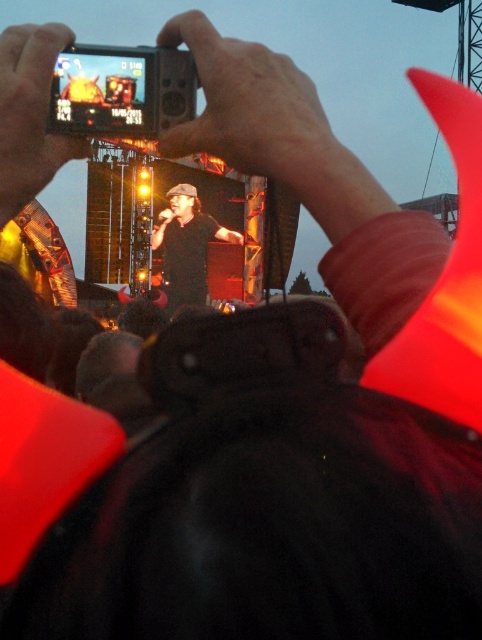
Question: Where is black plastic camera at upper center located in relation to matte black phone at upper left in the image?

Choices:
 (A) above
 (B) below

Answer: (A)

Question: Can you confirm if matte black phone at upper left is positioned to the right of black matte shirt at center?

Choices:
 (A) yes
 (B) no

Answer: (B)

Question: Which of the following is the farthest from the observer?

Choices:
 (A) matte black phone at upper left
 (B) black plastic camera at upper center
 (C) black matte shirt at center

Answer: (C)

Question: Which of the following is the closest to the observer?

Choices:
 (A) black matte shirt at center
 (B) matte black phone at upper left
 (C) black plastic camera at upper center

Answer: (B)

Question: Which object appears farthest from the camera in this image?

Choices:
 (A) black matte shirt at center
 (B) black plastic camera at upper center

Answer: (A)

Question: Is black plastic camera at upper center thinner than matte black phone at upper left?

Choices:
 (A) no
 (B) yes

Answer: (A)